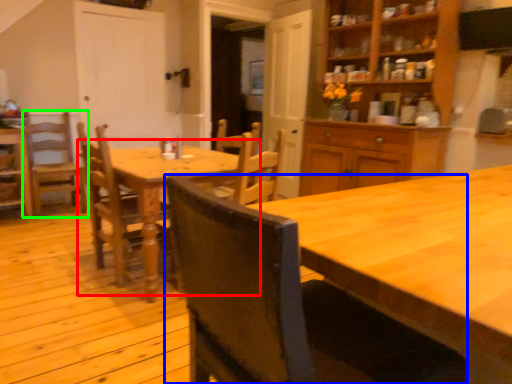
Question: Which object is the farthest from kitchen & dining room table (highlighted by a red box)? Choose among these: chair (highlighted by a blue box) or chair (highlighted by a green box).

Choices:
 (A) chair
 (B) chair

Answer: (A)